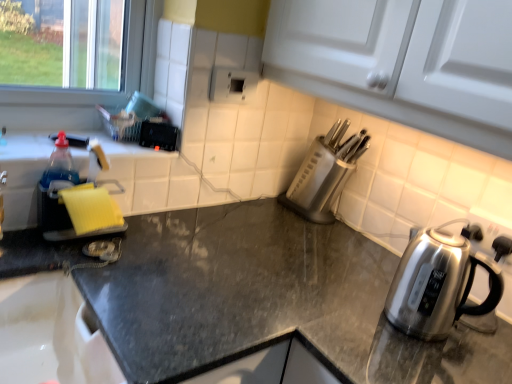
Question: Considering the positions of point (470, 249) and point (93, 218), is point (470, 249) closer or farther from the camera than point (93, 218)?

Choices:
 (A) closer
 (B) farther

Answer: (B)

Question: Do you think satin silver kettle at right is within yellow sponge at left, or outside of it?

Choices:
 (A) inside
 (B) outside

Answer: (B)

Question: Estimate the real-world distances between objects in this image. Which object is closer to the yellow sponge at left?

Choices:
 (A) satin silver kettle at right
 (B) satin silver knife block at center-right
 (C) black granite countertop at center

Answer: (C)

Question: Which of these objects is positioned farthest from the yellow sponge at left?

Choices:
 (A) satin silver kettle at right
 (B) black granite countertop at center
 (C) satin silver knife block at center-right

Answer: (A)